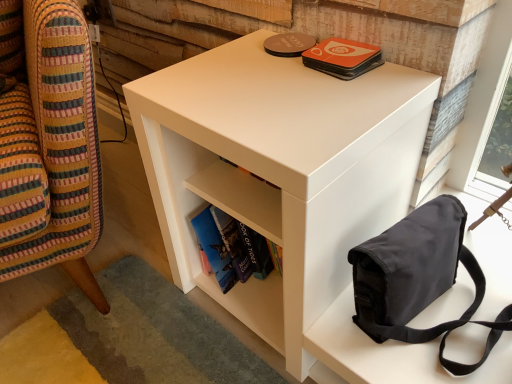
What do you see at coordinates (240, 197) in the screenshot? I see `white matte bookshelf at center` at bounding box center [240, 197].

What do you see at coordinates (342, 58) in the screenshot? I see `orange matte coaster at upper center` at bounding box center [342, 58].

At what (x,y) coordinates should I click in order to perform the action: click on white matte side table at lower right. Please return your answer as a coordinate pair (x, y). The height and width of the screenshot is (384, 512). Looking at the image, I should click on (48, 143).

What do you see at coordinates (419, 278) in the screenshot? I see `black canvas bag at upper right` at bounding box center [419, 278].

The height and width of the screenshot is (384, 512). In order to click on white matte nightstand at center in this screenshot , I will do `click(280, 171)`.

In the scene shown: In terms of height, does orange matte coaster at upper center look taller or shorter compared to white matte side table at lower right?

Clearly, orange matte coaster at upper center is shorter compared to white matte side table at lower right.

You are a GUI agent. You are given a task and a screenshot of the screen. Output one action in this format:
    pyautogui.click(x=<x>, y=<y>)
    Task: Click on the paperback book behind the white matte side table at lower right
    This screenshot has width=512, height=384.
    Given the screenshot: What is the action you would take?
    pyautogui.click(x=342, y=58)

Considering the points (327, 39) and (49, 80), which point is in front, point (327, 39) or point (49, 80)?

The point (49, 80) is in front.

Is white matte side table at lower right behind white matte bookshelf at center?

No, white matte side table at lower right is in front of white matte bookshelf at center.

Could you tell me if white matte side table at lower right is turned towards white matte bookshelf at center?

No, white matte side table at lower right is not oriented towards white matte bookshelf at center.

Which of these two, white matte side table at lower right or white matte bookshelf at center, is bigger?

white matte side table at lower right is bigger.

The height and width of the screenshot is (384, 512). Identify the location of cabinet on the right of white matte side table at lower right. (240, 197).

From the picture: From the image's perspective, is white matte nightstand at center located above or below orange matte coaster at upper center?

white matte nightstand at center is below orange matte coaster at upper center.

Would you say white matte nightstand at center contains orange matte coaster at upper center?

No, orange matte coaster at upper center is not surrounded by white matte nightstand at center.

Which is in front, white matte nightstand at center or orange matte coaster at upper center?

white matte nightstand at center.

From a real-world perspective, between white matte nightstand at center and orange matte coaster at upper center, who is vertically higher?

orange matte coaster at upper center, from a real-world perspective.

Which is behind, point (197, 166) or point (260, 209)?

The point (197, 166) is farther from the camera.

From the image's perspective, is white matte nightstand at center under white matte bookshelf at center?

Yes.

Is the depth of white matte nightstand at center less than that of white matte bookshelf at center?

Yes.

Locate an element on the screen. cabinet on the right of the white matte nightstand at center is located at coordinates (240, 197).

Between black canvas bag at upper right and white matte side table at lower right, which one has larger size?

white matte side table at lower right is bigger.

Which is closer, (417,307) or (71,92)?

Point (417,307)

Choose the correct answer: Is black canvas bag at upper right inside white matte side table at lower right or outside it?

black canvas bag at upper right lies outside white matte side table at lower right.

Between black canvas bag at upper right and white matte side table at lower right, which one appears on the right side from the viewer's perspective?

Positioned to the right is black canvas bag at upper right.

Based on the photo, is white matte bookshelf at center positioned with its back to orange matte coaster at upper center?

white matte bookshelf at center is not turned away from orange matte coaster at upper center.

Can orange matte coaster at upper center be found inside white matte bookshelf at center?

No.

From the image's perspective, is white matte bookshelf at center located beneath orange matte coaster at upper center?

Yes.

Considering the relative positions of white matte bookshelf at center and orange matte coaster at upper center in the image provided, is white matte bookshelf at center to the left of orange matte coaster at upper center from the viewer's perspective?

Yes.

Considering the points (366, 275) and (401, 179), which point is in front, point (366, 275) or point (401, 179)?

The point (366, 275) is closer.

At what (x,y) coordinates should I click in order to perform the action: click on nightstand below the black canvas bag at upper right (from a real-world perspective). Please return your answer as a coordinate pair (x, y). Looking at the image, I should click on (280, 171).

Is black canvas bag at upper right surrounding white matte nightstand at center?

No, white matte nightstand at center is located outside of black canvas bag at upper right.

Based on the photo, considering the relative sizes of black canvas bag at upper right and white matte nightstand at center in the image provided, is black canvas bag at upper right bigger than white matte nightstand at center?

Incorrect, black canvas bag at upper right is not larger than white matte nightstand at center.

The image size is (512, 384). In order to click on paperback book located behind the white matte side table at lower right in this screenshot , I will do `click(342, 58)`.

What are the coordinates of `furniture above the white matte bookshelf at center (from a real-world perspective)` in the screenshot? It's located at (48, 143).

Estimate the real-world distances between objects in this image. Which object is further from white matte nightstand at center, black canvas bag at upper right or white matte bookshelf at center?

black canvas bag at upper right is positioned further to the anchor white matte nightstand at center.

Estimate the real-world distances between objects in this image. Which object is further from orange matte coaster at upper center, white matte nightstand at center or white matte bookshelf at center?

white matte bookshelf at center is positioned further to the anchor orange matte coaster at upper center.

Based on their spatial positions, is white matte bookshelf at center or white matte side table at lower right further from white matte nightstand at center?

The object further to white matte nightstand at center is white matte side table at lower right.

From the image, which object appears to be farther from black canvas bag at upper right, orange matte coaster at upper center or white matte nightstand at center?

The object further to black canvas bag at upper right is orange matte coaster at upper center.

Estimate the real-world distances between objects in this image. Which object is closer to white matte side table at lower right, white matte bookshelf at center or black canvas bag at upper right?

Based on the image, white matte bookshelf at center appears to be nearer to white matte side table at lower right.

Considering their positions, is white matte side table at lower right positioned closer to orange matte coaster at upper center than black canvas bag at upper right?

black canvas bag at upper right is positioned closer to the anchor orange matte coaster at upper center.

From the image, which object appears to be farther from orange matte coaster at upper center, white matte bookshelf at center or black canvas bag at upper right?

black canvas bag at upper right.

Based on their spatial positions, is white matte bookshelf at center or white matte side table at lower right further from black canvas bag at upper right?

Based on the image, white matte side table at lower right appears to be further to black canvas bag at upper right.

What are the coordinates of `nightstand between white matte side table at lower right and orange matte coaster at upper center in the horizontal direction` in the screenshot? It's located at (280, 171).

Identify the location of cabinet between orange matte coaster at upper center and black canvas bag at upper right from top to bottom. (240, 197).

Find the location of a particular element. This screenshot has width=512, height=384. nightstand between white matte side table at lower right and black canvas bag at upper right is located at coordinates (280, 171).

At what (x,y) coordinates should I click in order to perform the action: click on paperback book between white matte nightstand at center and black canvas bag at upper right from left to right. Please return your answer as a coordinate pair (x, y). This screenshot has height=384, width=512. Looking at the image, I should click on (342, 58).